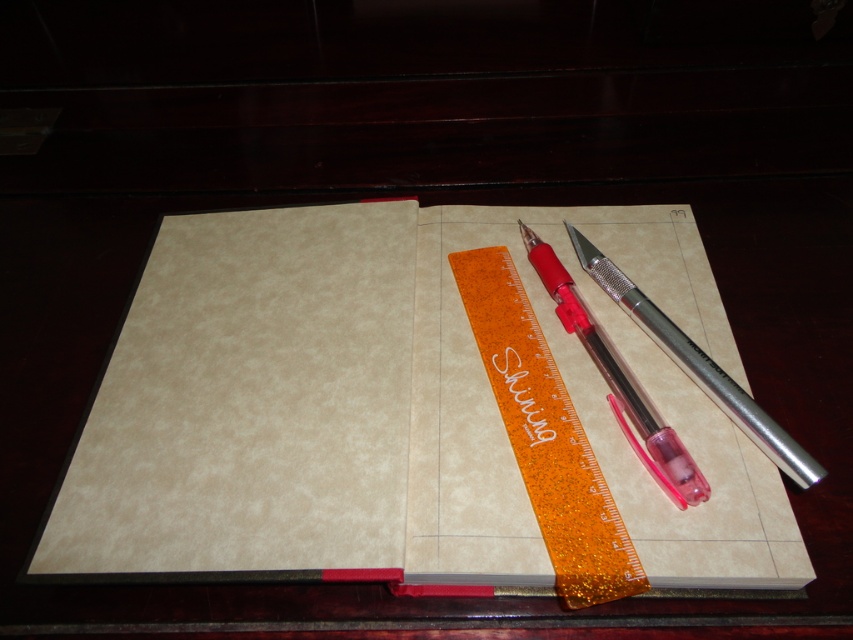
You are organizing your desk and need to place a new item between the orange glitter ruler at center and the transparent plastic pencil at center. Which item should you place closer to you to maintain the current arrangement?

You should place the new item closer to the orange glitter ruler at center since it is already closer to the viewer than the transparent plastic pencil at center, maintaining their relative positions.